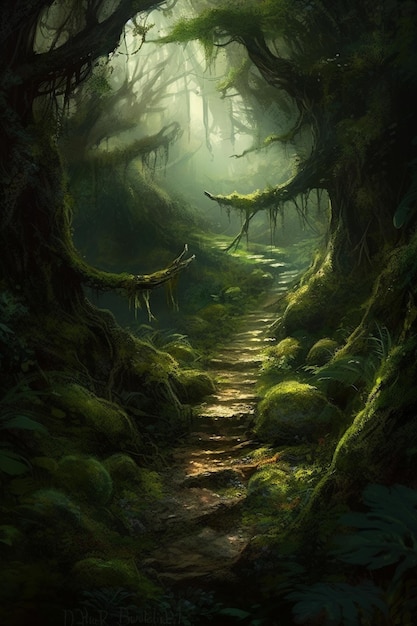
What are the coordinates of `plant` in the screenshot? It's located at (352, 376).